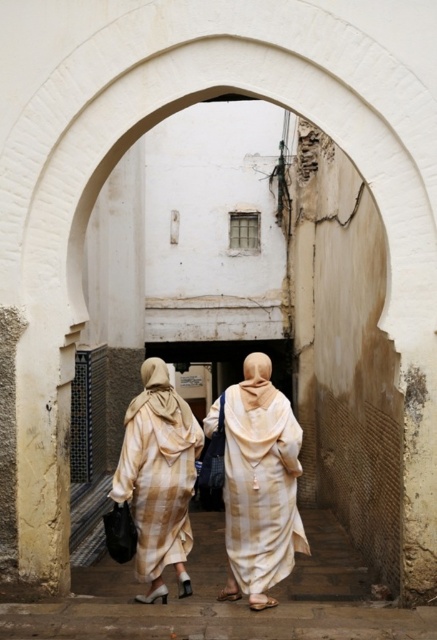
Does point (304, 540) come behind point (173, 433)?

No.

Is the position of beige cotton dress at center more distant than that of beige striped robe at center?

No, it is in front of beige striped robe at center.

Who is more forward, (292, 452) or (179, 476)?

Point (292, 452) is more forward.

This screenshot has height=640, width=437. Find the location of `beige cotton dress at center`. beige cotton dress at center is located at coordinates (260, 484).